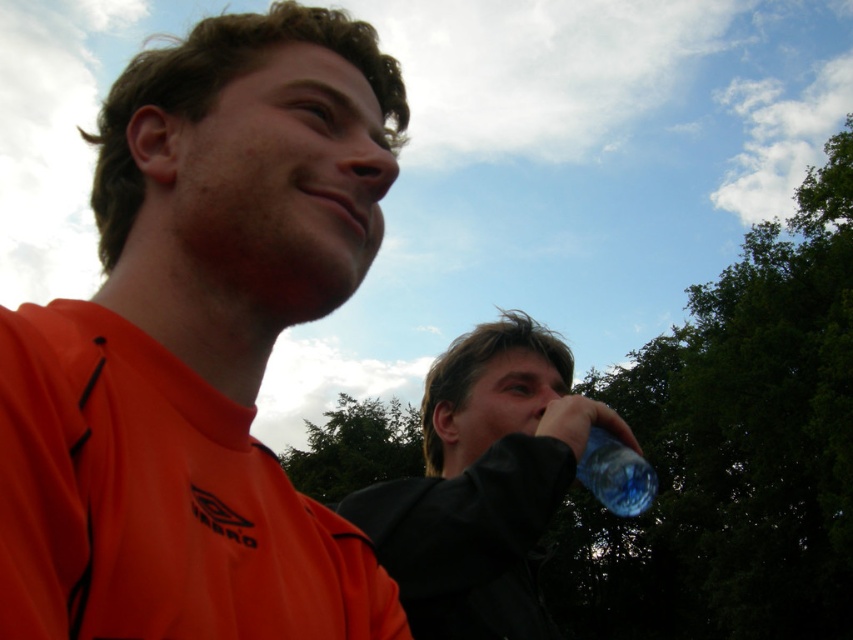
Based on the photo, you are a photographer trying to capture the transparent plastic bottle at center in the image. The camera has a focus point at coordinate point (483, 483). Is the focus point correctly placed to capture the transparent plastic bottle at center?

Yes, the focus point at point (483, 483) is correctly placed because the point marks the transparent plastic bottle at center.

Based on the photo, you are standing at the camera position and want to reach the point marked as point (213, 193). If you take a step forward of 3 feet, will you be closer to the point than 2 feet?

The distance between point (213, 193) and the camera is 4.47 feet. After stepping forward 3 feet, you will be 1.47 feet away from the point, which is closer than 2 feet.